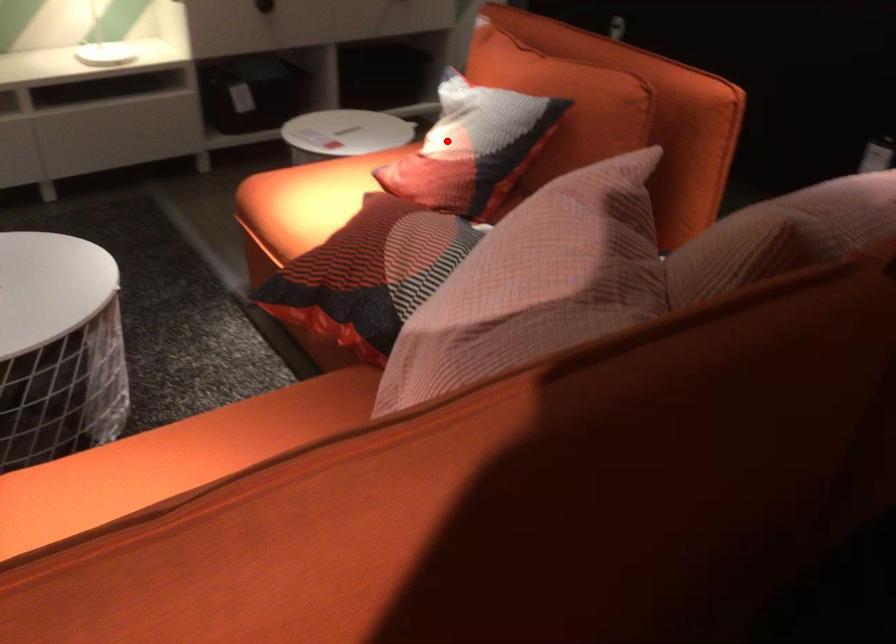
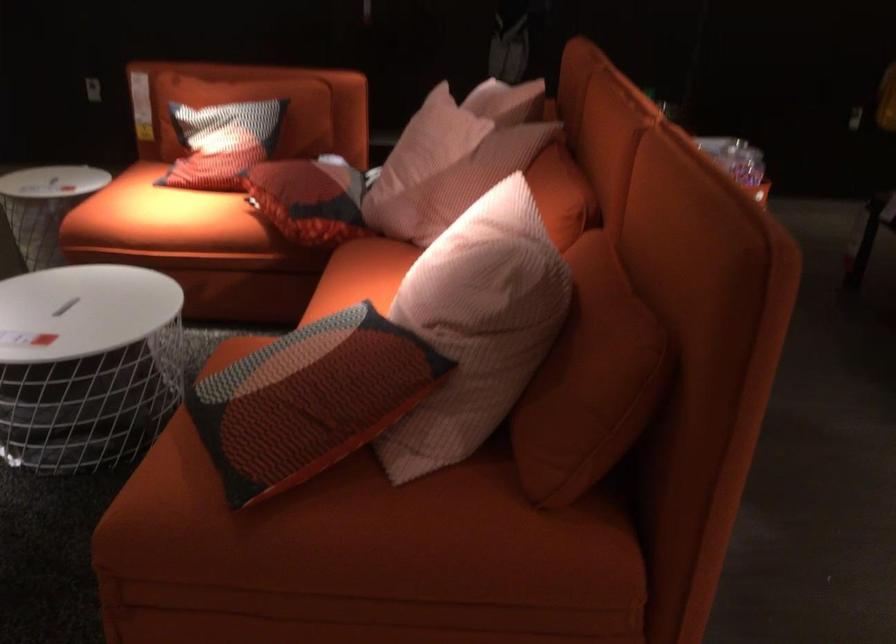
Find the pixel in the second image that matches the highlighted location in the first image.

(222, 142)